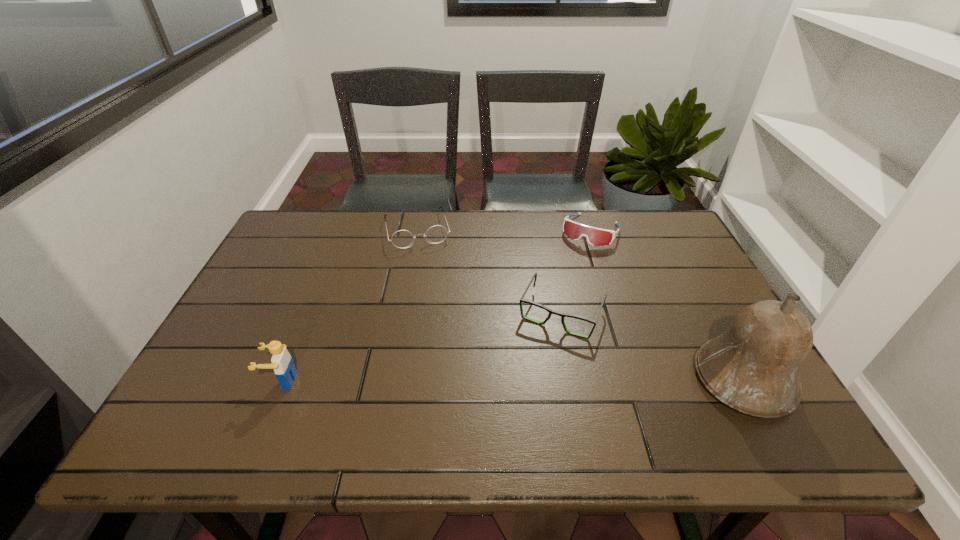
This screenshot has height=540, width=960. I want to click on the fourth shortest object, so click(x=282, y=363).

Locate an element on the screen. The height and width of the screenshot is (540, 960). Lego is located at coordinates (282, 363).

This screenshot has height=540, width=960. I want to click on the rightmost object, so click(x=754, y=367).

This screenshot has height=540, width=960. What are the coordinates of `bell` in the screenshot? It's located at (754, 367).

In order to click on the third nearest object in this screenshot , I will do `click(549, 310)`.

This screenshot has height=540, width=960. What are the coordinates of `the right spectacles` in the screenshot? It's located at [549, 310].

Image resolution: width=960 pixels, height=540 pixels. I want to click on goggles, so click(x=595, y=236).

Identify the location of the second object from left to right. (401, 239).

Identify the location of the farther spectacles. (401, 239).

Where is `vacant area located on the face of the Lego`? This screenshot has height=540, width=960. vacant area located on the face of the Lego is located at coordinates (200, 381).